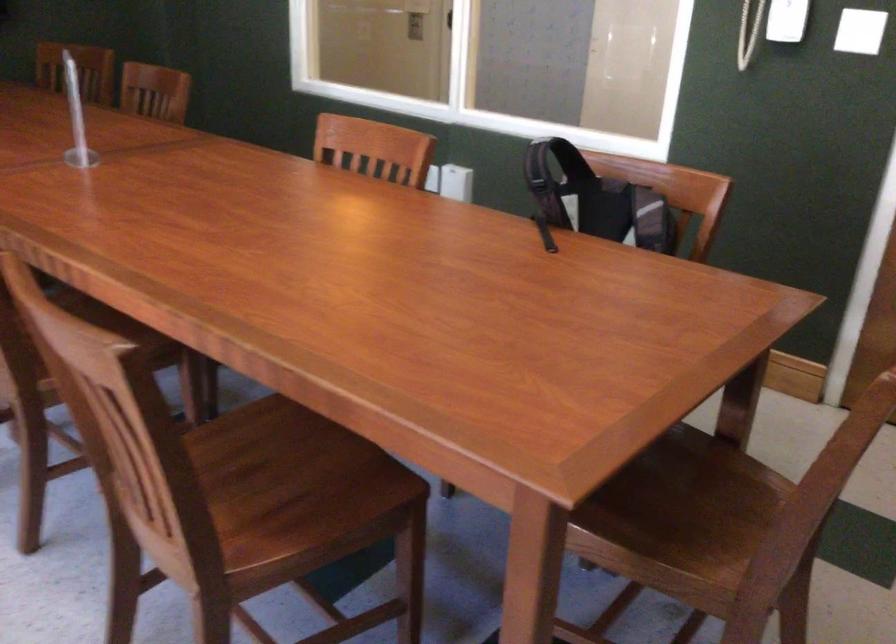
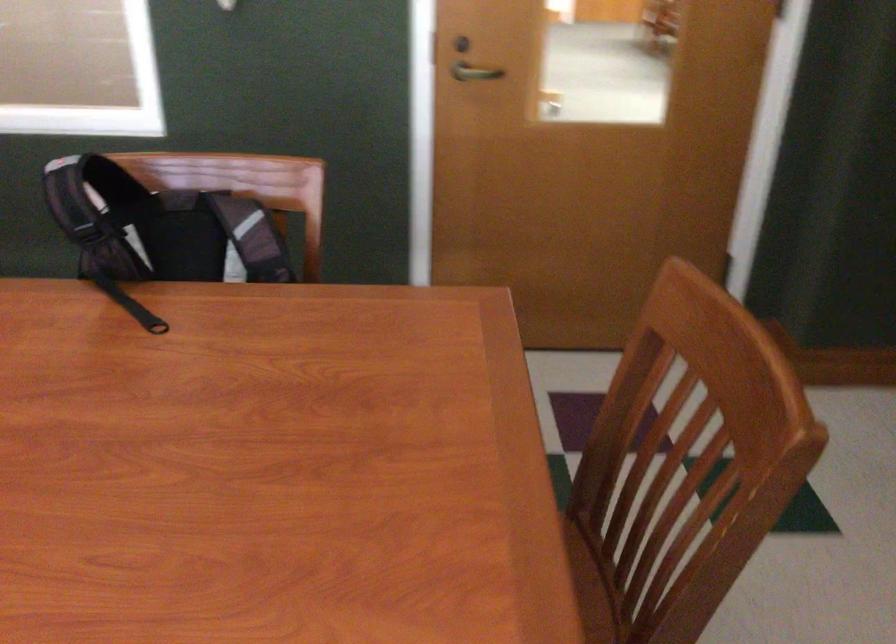
Locate, in the second image, the point that corresponds to point (591, 196) in the first image.

(159, 228)